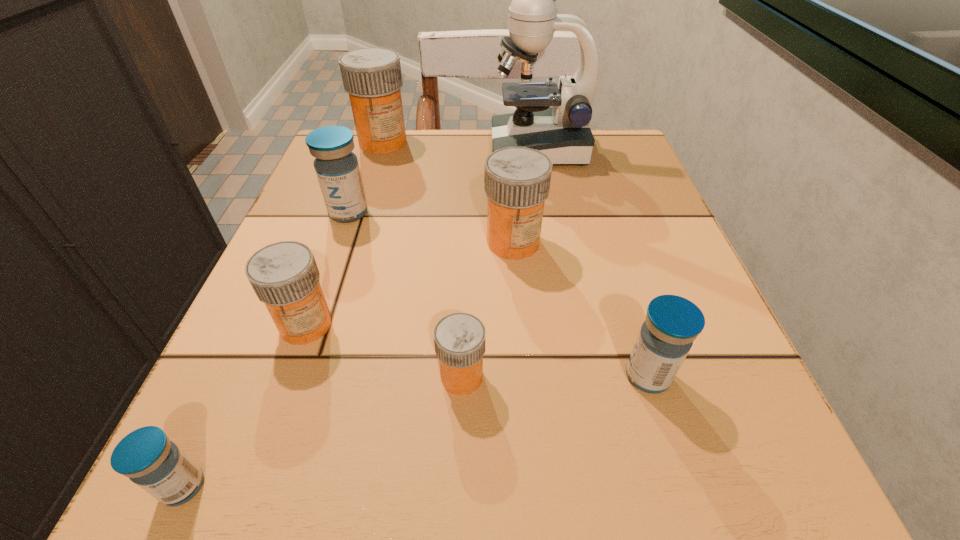
Locate an element on the screen. object present at the far left corner is located at coordinates (372, 76).

The image size is (960, 540). Identify the location of object at the near left corner. (157, 465).

Image resolution: width=960 pixels, height=540 pixels. In order to click on object located in the far right corner section of the desktop in this screenshot , I will do `click(562, 132)`.

In the image, there is a desktop. Identify the location of vacant space at the far edge. (473, 183).

At what (x,y) coordinates should I click in order to perform the action: click on vacant area at the near edge of the desktop. Please return your answer as a coordinate pair (x, y). The width and height of the screenshot is (960, 540). Looking at the image, I should click on (366, 437).

Identify the location of blank space at the left edge. This screenshot has height=540, width=960. (257, 298).

At what (x,y) coordinates should I click in order to perform the action: click on free region at the right edge of the desktop. Please return your answer as a coordinate pair (x, y). This screenshot has height=540, width=960. Looking at the image, I should click on (579, 217).

Locate an element on the screen. Image resolution: width=960 pixels, height=540 pixels. vacant space at the near left corner of the desktop is located at coordinates (191, 511).

Where is `blank space at the near right corner`? blank space at the near right corner is located at coordinates point(663,453).

The width and height of the screenshot is (960, 540). Find the location of `free space between the third medicine from right to left and the rightmost blue medicine`. free space between the third medicine from right to left and the rightmost blue medicine is located at coordinates (555, 376).